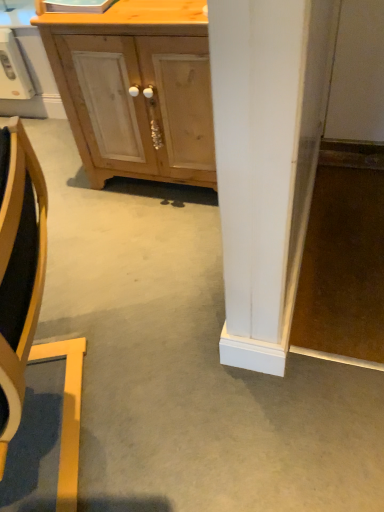
Question: Would you say wooden chair at left is to the left or to the right of white plastic microwave at upper left in the picture?

Choices:
 (A) left
 (B) right

Answer: (B)

Question: Considering the positions of point (66, 386) and point (16, 48), is point (66, 386) closer or farther from the camera than point (16, 48)?

Choices:
 (A) closer
 (B) farther

Answer: (A)

Question: Which is farther from the light wood cabinet at center?

Choices:
 (A) white plastic microwave at upper left
 (B) wooden chair at left

Answer: (A)

Question: Which object is positioned closest to the wooden chair at left?

Choices:
 (A) white plastic microwave at upper left
 (B) light wood cabinet at center

Answer: (B)